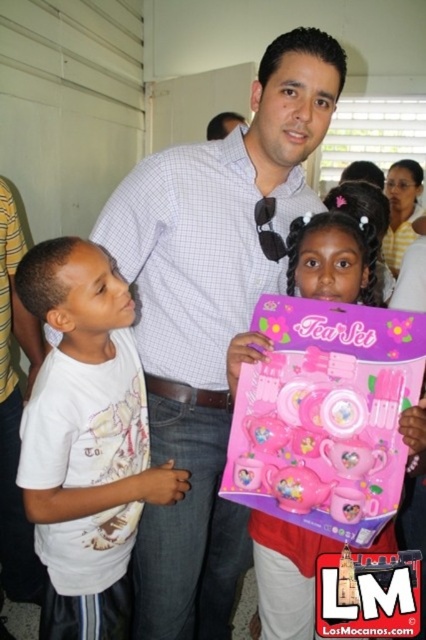
Question: Is white cotton shirt at left positioned behind pink plastic tea set at center?

Choices:
 (A) no
 (B) yes

Answer: (A)

Question: Is white cotton shirt at left to the left of pink plastic tea set at center from the viewer's perspective?

Choices:
 (A) yes
 (B) no

Answer: (A)

Question: Observing the image, what is the correct spatial positioning of white cotton shirt at left in reference to pink plastic tea set at center?

Choices:
 (A) above
 (B) below

Answer: (B)

Question: Which object is farther from the camera taking this photo?

Choices:
 (A) white cotton shirt at left
 (B) pink plastic tea set at center

Answer: (B)

Question: Which point appears farthest from the camera in this image?

Choices:
 (A) click(402, 419)
 (B) click(94, 300)

Answer: (B)